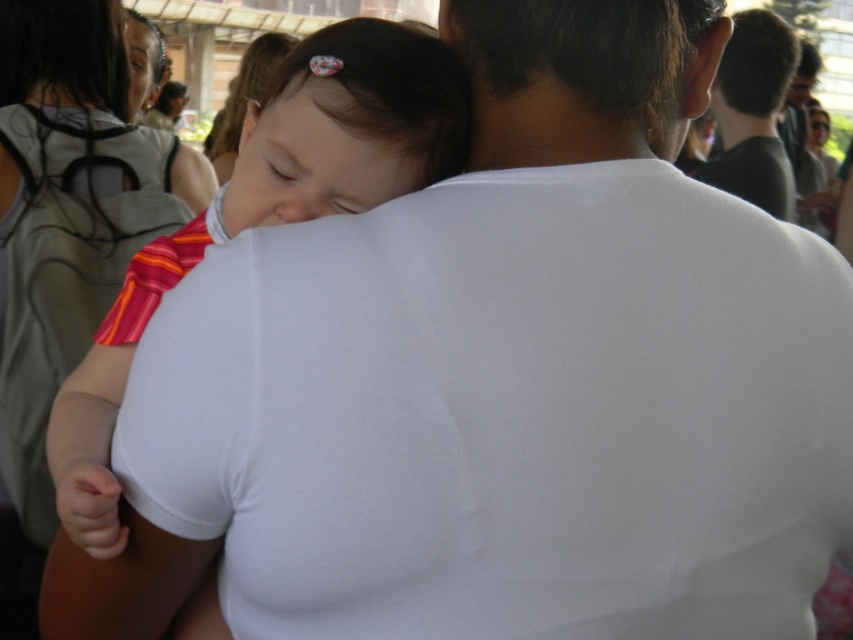
You are a photographer trying to focus on two points in the image, point (166, 134) and point (737, 54). Which point should you adjust your camera focus to first if you want to capture the closest object in the scene?

Point (166, 134) is closer to the camera than point (737, 54), so you should focus on point (166, 134) first to capture the closest object.

You are a photographer trying to capture a candid shot of the matte white shirt at center and the black matte hair at upper right in the scene. Based on their positions, which object would appear closer to the camera in the photo?

The matte white shirt at center has a lesser height compared to the black matte hair at upper right, so the matte white shirt at center would appear closer to the camera in the photo.

Consider the image. You are a photographer trying to capture the scene of the adult holding the child. You notice the matte white tank top at upper left and the black matte hair at upper right in your camera frame. Which object should you focus on first if you want to ensure both are in focus?

The matte white tank top at upper left is closer to the viewer than the black matte hair at upper right, so focusing on the matte white tank top at upper left first will help ensure both are in focus since it is the closer object.